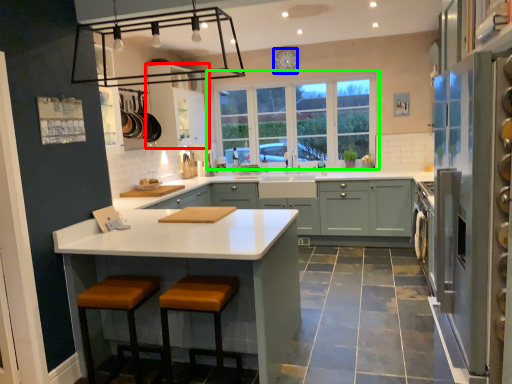
Question: Estimate the real-world distances between objects in this image. Which object is closer to cabinetry (highlighted by a red box), clock (highlighted by a blue box) or window (highlighted by a green box)?

Choices:
 (A) clock
 (B) window

Answer: (B)